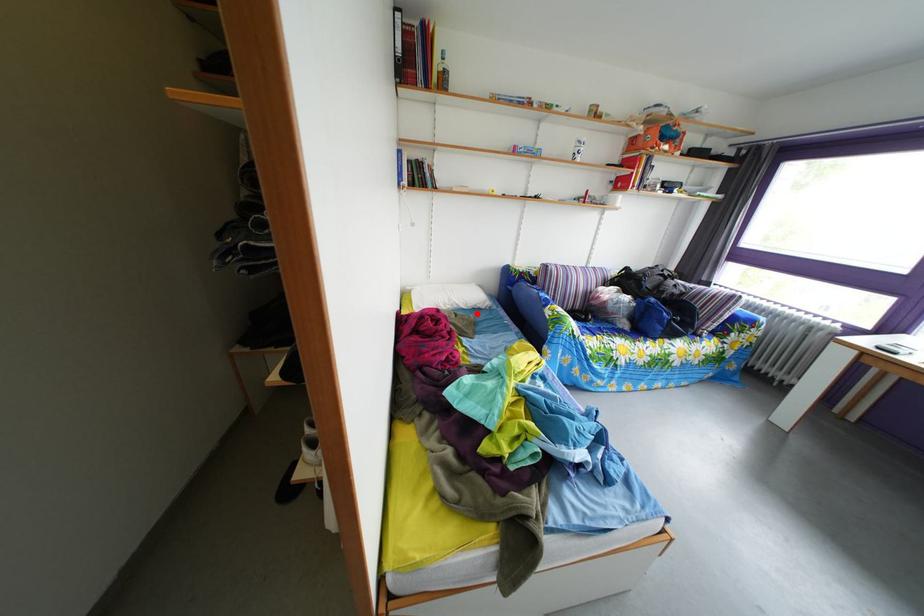
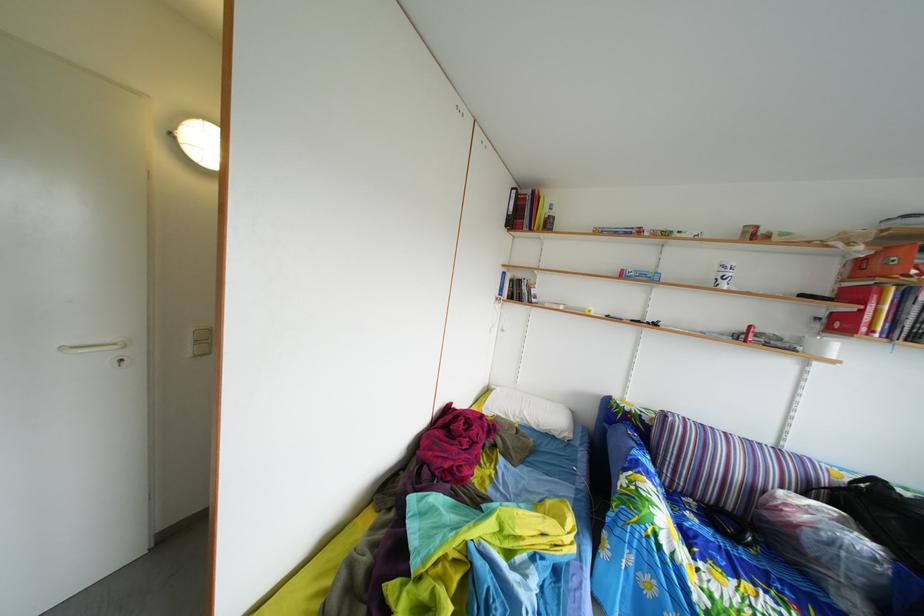
Find the pixel in the second image that matches the highlighted location in the first image.

(549, 434)